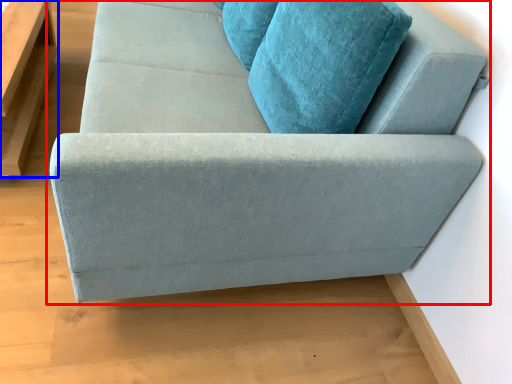
Question: Which point is further to the camera, studio couch (highlighted by a red box) or table (highlighted by a blue box)?

Choices:
 (A) studio couch
 (B) table

Answer: (B)